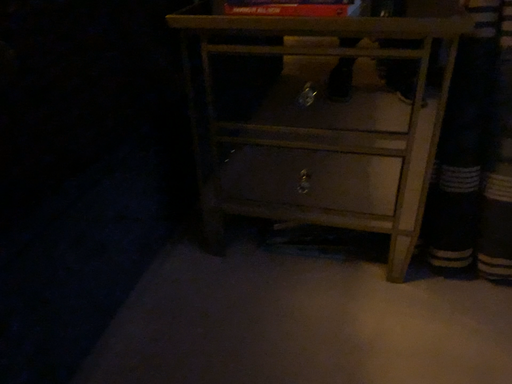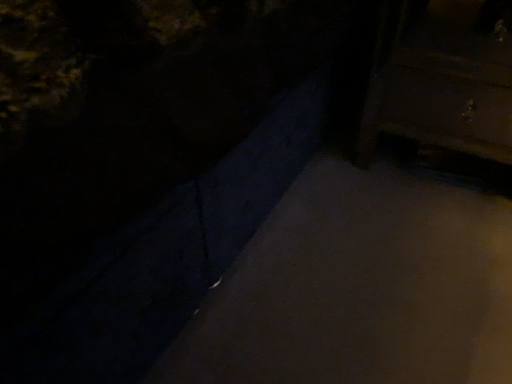
Question: How did the camera likely rotate when shooting the video?

Choices:
 (A) rotated downward
 (B) rotated upward

Answer: (A)